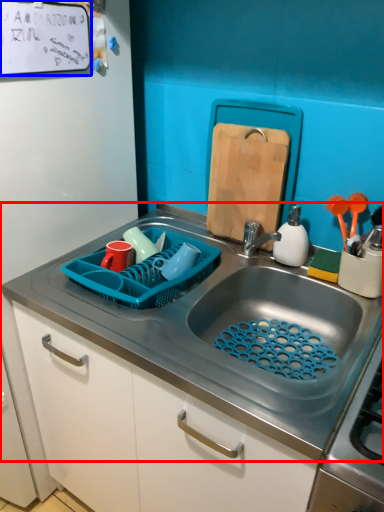
Question: Which of the following is the closest to the observer, sink (highlighted by a red box) or bulletin board (highlighted by a blue box)?

Choices:
 (A) sink
 (B) bulletin board

Answer: (A)